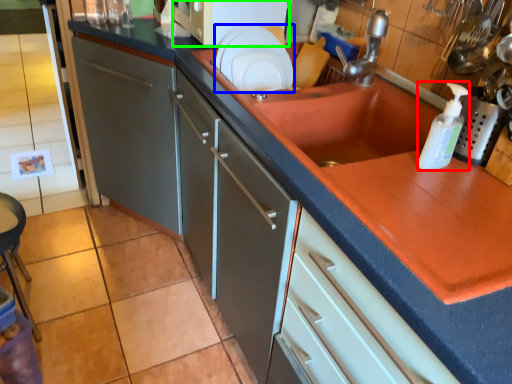
Question: Which object is the farthest from bottle (highlighted by a red box)? Choose among these: plate (highlighted by a blue box) or microwave (highlighted by a green box).

Choices:
 (A) plate
 (B) microwave

Answer: (B)